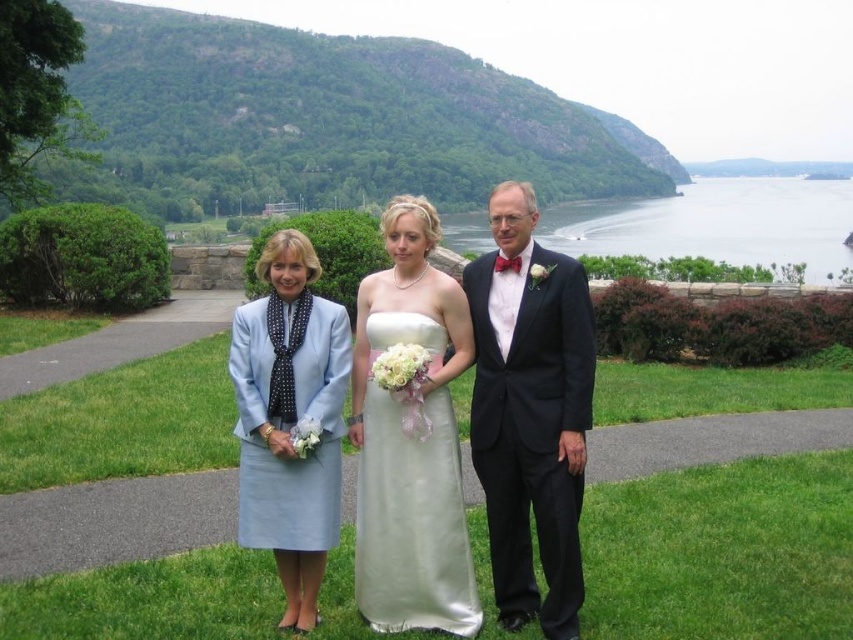
From the picture: Based on the scene description, which dress has a larger size between the white satin dress at center and the light blue fabric dress at center?

The white satin dress at center has a larger size compared to the light blue fabric dress at center.

You are a photographer positioned at the origin point of the scene. You need to capture a photo of the black satin suit at center. What are the coordinates where you should focus your camera?

The coordinates to focus the camera on the black satin suit at center are at point (531, 412).